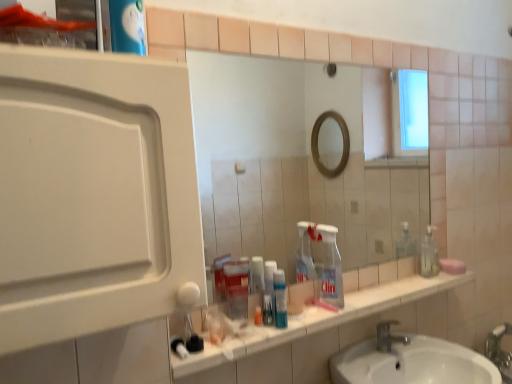
Question: Considering the relative sizes of white matte medicine cabinet at left and translucent plastic container at center, which is the first bottle in left-to-right order, in the image provided, is white matte medicine cabinet at left bigger than translucent plastic container at center, which is the first bottle in left-to-right order,?

Choices:
 (A) no
 (B) yes

Answer: (B)

Question: Is white matte medicine cabinet at left closer to the viewer compared to translucent plastic container at center, which is the first bottle in left-to-right order?

Choices:
 (A) yes
 (B) no

Answer: (A)

Question: Considering the relative sizes of white matte medicine cabinet at left and translucent plastic container at center, which is the first bottle in left-to-right order, in the image provided, is white matte medicine cabinet at left shorter than translucent plastic container at center, which is the first bottle in left-to-right order,?

Choices:
 (A) no
 (B) yes

Answer: (A)

Question: Can you confirm if white matte medicine cabinet at left is taller than translucent plastic container at center, the 1th bottle from the front?

Choices:
 (A) no
 (B) yes

Answer: (B)

Question: Does white matte medicine cabinet at left appear on the left side of translucent plastic container at center, which is the 2th bottle in right-to-left order?

Choices:
 (A) no
 (B) yes

Answer: (B)

Question: From the image's perspective, is white matte medicine cabinet at left positioned above or below pink matte soap at right?

Choices:
 (A) below
 (B) above

Answer: (B)

Question: Considering the positions of point (113, 264) and point (440, 264), is point (113, 264) closer or farther from the camera than point (440, 264)?

Choices:
 (A) farther
 (B) closer

Answer: (B)

Question: Relative to pink matte soap at right, is white matte medicine cabinet at left in front or behind?

Choices:
 (A) behind
 (B) front

Answer: (B)

Question: Is white matte medicine cabinet at left inside the boundaries of pink matte soap at right, or outside?

Choices:
 (A) outside
 (B) inside

Answer: (A)

Question: Is clear plastic bottle at center to the left or to the right of translucent plastic toothpaste at center, the second bottle when ordered from left to right, in the image?

Choices:
 (A) right
 (B) left

Answer: (A)

Question: Which is correct: clear plastic bottle at center is inside translucent plastic toothpaste at center, which ranks as the 2th bottle in front-to-back order, or outside of it?

Choices:
 (A) inside
 (B) outside

Answer: (B)

Question: Considering the positions of clear plastic bottle at center and translucent plastic toothpaste at center, which is the first bottle in back-to-front order, in the image, is clear plastic bottle at center bigger or smaller than translucent plastic toothpaste at center, which is the first bottle in back-to-front order,?

Choices:
 (A) small
 (B) big

Answer: (B)

Question: Is point (328, 276) positioned closer to the camera than point (268, 291)?

Choices:
 (A) closer
 (B) farther

Answer: (B)

Question: Is silver metallic faucet at lower center bigger or smaller than translucent plastic toothpaste at center, which ranks as the 2th bottle in front-to-back order?

Choices:
 (A) small
 (B) big

Answer: (B)

Question: From a real-world perspective, is silver metallic faucet at lower center physically located above or below translucent plastic toothpaste at center, which is the first bottle in back-to-front order?

Choices:
 (A) above
 (B) below

Answer: (B)